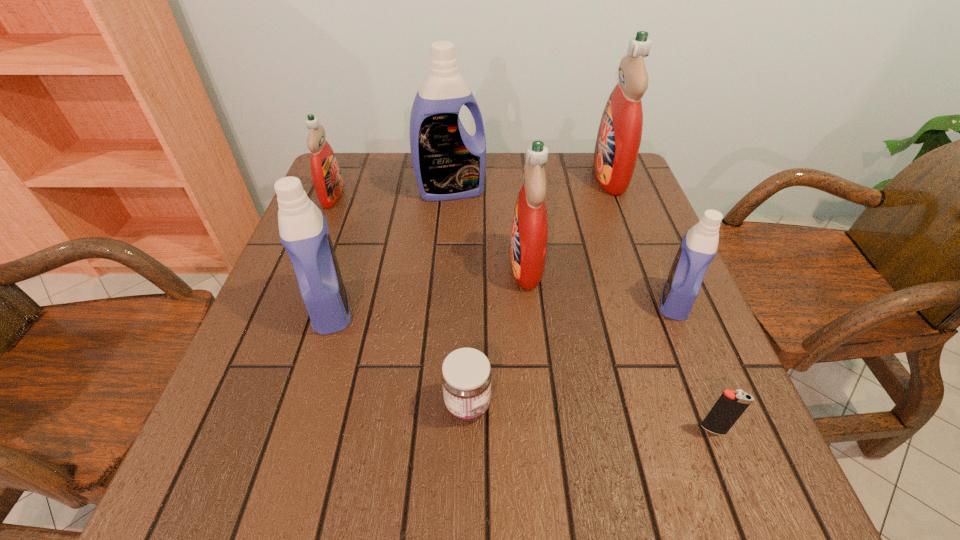
I want to click on vacant space at the near right corner of the desktop, so click(x=694, y=476).

In order to click on vacant point located between the igniter and the jam in this screenshot , I will do `click(590, 416)`.

Locate an element on the screen. The height and width of the screenshot is (540, 960). free space between the second red detergent from left to right and the farthest blue detergent is located at coordinates (489, 228).

Find the location of a particular element. vacant space that's between the rightmost blue detergent and the biggest blue detergent is located at coordinates (563, 246).

Where is `empty space between the biggest red detergent and the smallest blue detergent`? The image size is (960, 540). empty space between the biggest red detergent and the smallest blue detergent is located at coordinates (642, 239).

Image resolution: width=960 pixels, height=540 pixels. I want to click on free space that is in between the jam and the nearest red detergent, so click(x=497, y=335).

The width and height of the screenshot is (960, 540). I want to click on free spot between the leftmost red detergent and the second blue detergent from left to right, so click(392, 193).

Locate an element on the screen. The height and width of the screenshot is (540, 960). empty location between the smallest red detergent and the smallest blue detergent is located at coordinates pyautogui.click(x=504, y=248).

The height and width of the screenshot is (540, 960). I want to click on unoccupied position between the leftmost object and the rightmost blue detergent, so click(x=504, y=248).

Where is `blank region between the igniter and the jam`? The height and width of the screenshot is (540, 960). blank region between the igniter and the jam is located at coordinates (590, 416).